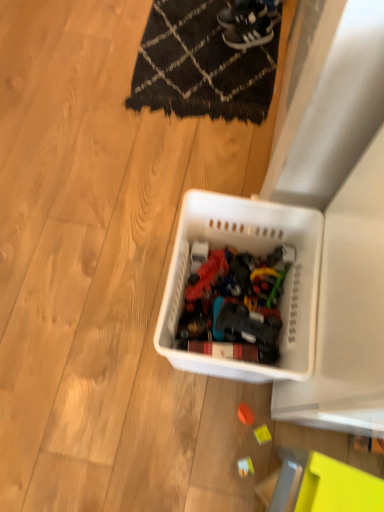
Find the location of a particular element. The width and height of the screenshot is (384, 512). vacant area that lies between white plastic basket at center and yellow plastic toy at lower right, arranged as the 2th toy when ordered from the bottom is located at coordinates (231, 402).